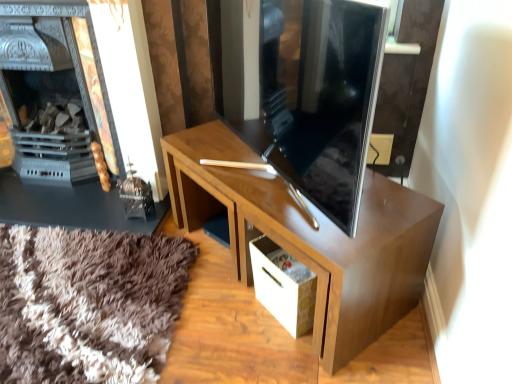
I want to click on free space to the left of glossy wood desk at center, so click(x=126, y=293).